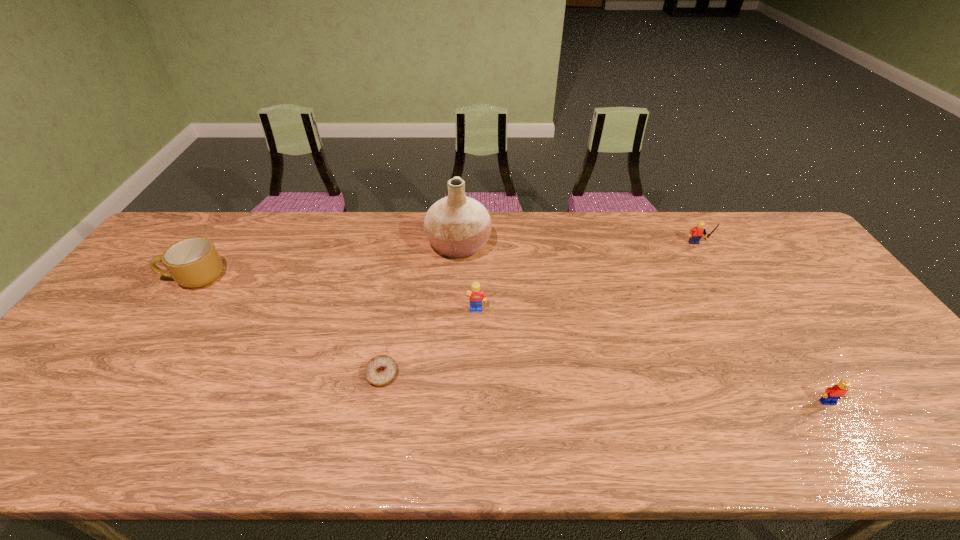
What are the coordinates of `pottery` in the screenshot? It's located at (458, 226).

At what (x,y) coordinates should I click in order to perform the action: click on the second Lego from left to right. Please return your answer as a coordinate pair (x, y). The height and width of the screenshot is (540, 960). Looking at the image, I should click on (696, 233).

The width and height of the screenshot is (960, 540). Find the location of `the farthest Lego`. the farthest Lego is located at coordinates (696, 233).

Identify the location of the leftmost object. The height and width of the screenshot is (540, 960). (194, 262).

Find the location of a particular element. This screenshot has height=540, width=960. the second farthest Lego is located at coordinates (475, 295).

Find the location of a particular element. This screenshot has width=960, height=540. the fourth farthest object is located at coordinates (475, 295).

Find the location of a particular element. the rightmost Lego is located at coordinates (831, 395).

At what (x,y) coordinates should I click in order to perform the action: click on the nearest object. Please return your answer as a coordinate pair (x, y). The height and width of the screenshot is (540, 960). Looking at the image, I should click on (831, 395).

Where is `the fifth object from right to left`? The height and width of the screenshot is (540, 960). the fifth object from right to left is located at coordinates (380, 370).

Locate an element on the screen. The height and width of the screenshot is (540, 960). doughnut is located at coordinates (380, 370).